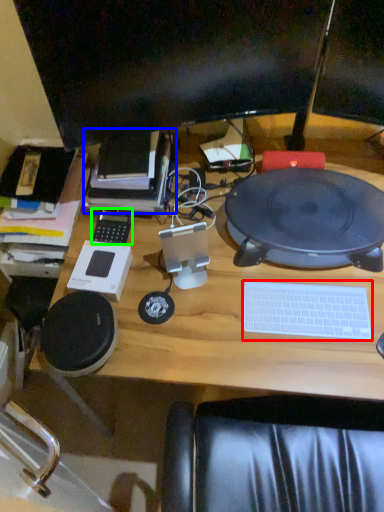
Question: Which is farther away from computer keyboard (highlighted by a red box)? book (highlighted by a blue box) or gadget (highlighted by a green box)?

Choices:
 (A) book
 (B) gadget

Answer: (B)